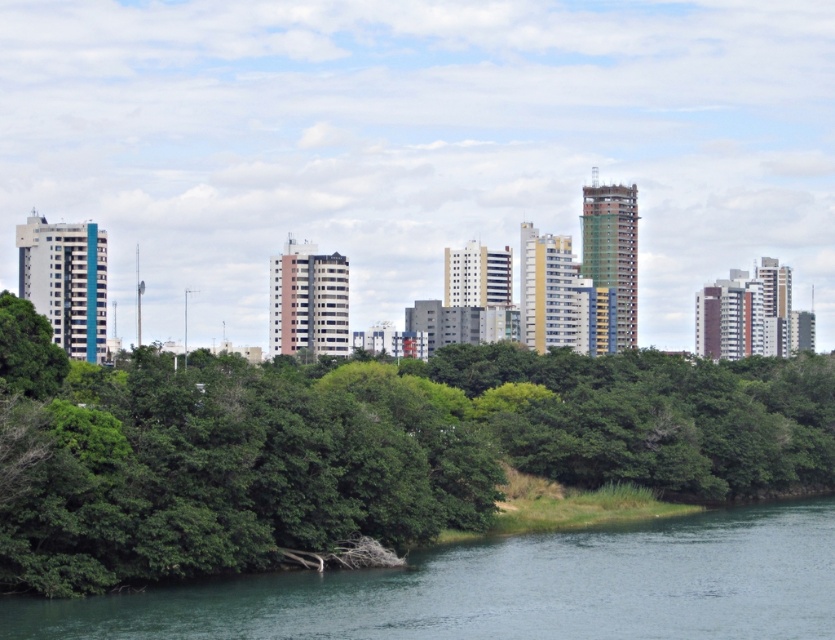
Question: Among these points, which one is farthest from the camera?

Choices:
 (A) (749, 435)
 (B) (463, 609)

Answer: (A)

Question: Which point is closer to the camera?

Choices:
 (A) (331, 408)
 (B) (813, 596)

Answer: (B)

Question: Observing the image, what is the correct spatial positioning of green leafy tree at center in reference to greenish-blue water at lower center?

Choices:
 (A) above
 (B) below

Answer: (A)

Question: Can you confirm if green leafy tree at center is positioned above greenish-blue water at lower center?

Choices:
 (A) yes
 (B) no

Answer: (A)

Question: Which object is closer to the camera taking this photo?

Choices:
 (A) greenish-blue water at lower center
 (B) green leafy tree at center

Answer: (A)

Question: Is the position of green leafy tree at center more distant than that of greenish-blue water at lower center?

Choices:
 (A) no
 (B) yes

Answer: (B)